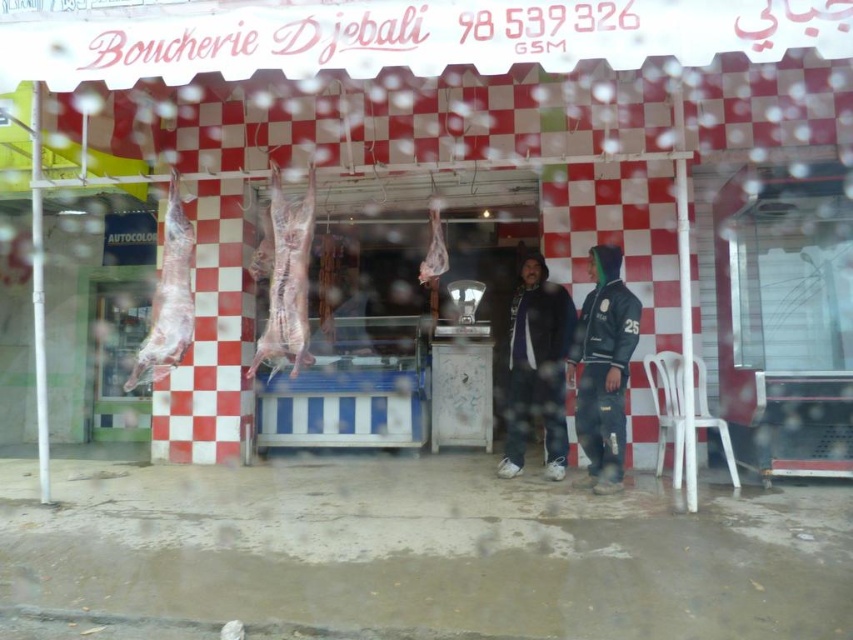
Question: Which is farther from the raw meat at left?

Choices:
 (A) dark blue jeans at center
 (B) pinkish raw meat at center

Answer: (A)

Question: Which point appears farthest from the camera in this image?

Choices:
 (A) (273, 225)
 (B) (427, 260)
 (C) (136, 369)
 (D) (605, 413)

Answer: (D)

Question: Does dark blue jeans at center appear over raw meat at left?

Choices:
 (A) yes
 (B) no

Answer: (B)

Question: Which point is farther to the camera?

Choices:
 (A) pink raw meat at center
 (B) pinkish raw meat at center
 (C) dark blue leather jacket at center
 (D) raw meat at left

Answer: (C)

Question: Is raw meat at left wider than pinkish raw meat at center?

Choices:
 (A) yes
 (B) no

Answer: (A)

Question: Does dark blue jeans at center have a greater width compared to pinkish raw meat at center?

Choices:
 (A) yes
 (B) no

Answer: (A)